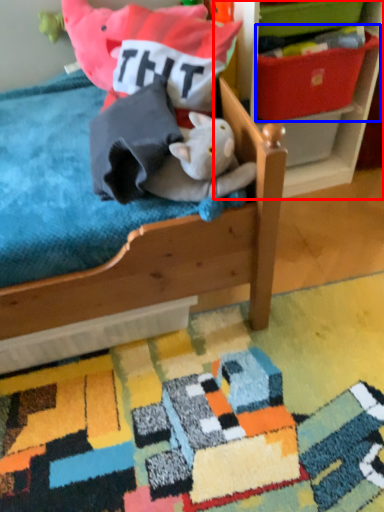
Question: Which object is closer to the camera taking this photo, shelf (highlighted by a red box) or storage box (highlighted by a blue box)?

Choices:
 (A) shelf
 (B) storage box

Answer: (A)